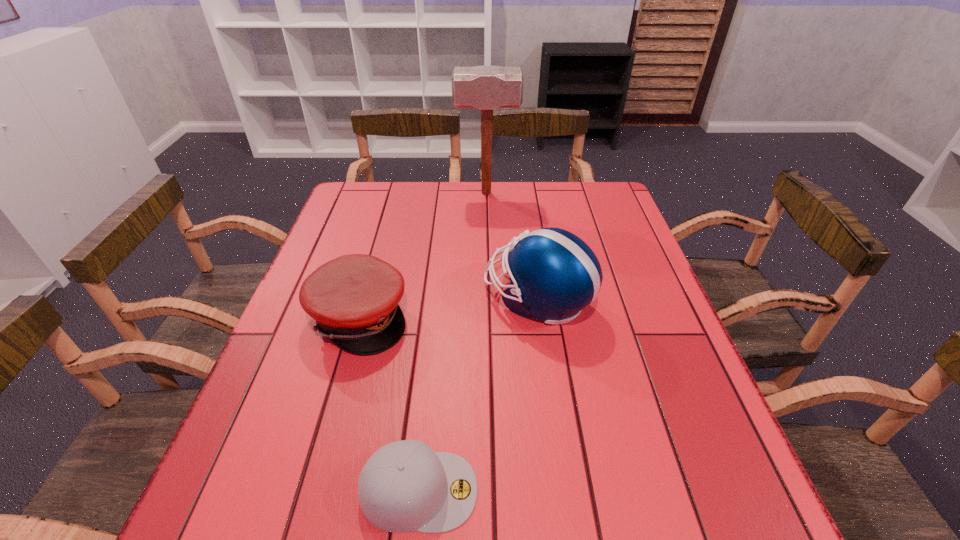
You are a GUI agent. You are given a task and a screenshot of the screen. Output one action in this format:
    pyautogui.click(x=<x>, y=<y>)
    Task: Click on the tallest object
    Image resolution: width=960 pixels, height=540 pixels.
    Given the screenshot: What is the action you would take?
    pyautogui.click(x=487, y=88)

The image size is (960, 540). I want to click on the farthest object, so click(x=487, y=88).

At what (x,y) coordinates should I click in order to perform the action: click on the third shortest object. Please return your answer as a coordinate pair (x, y). The width and height of the screenshot is (960, 540). Looking at the image, I should click on (554, 274).

The image size is (960, 540). What are the coordinates of `the taller cap` in the screenshot? It's located at (354, 298).

Where is `the farther cap`? This screenshot has height=540, width=960. the farther cap is located at coordinates (354, 298).

I want to click on the shortest object, so click(405, 486).

Image resolution: width=960 pixels, height=540 pixels. Identify the location of the nearest object. (405, 486).

Image resolution: width=960 pixels, height=540 pixels. I want to click on blank space located on the striking face of the mallet, so click(346, 193).

Image resolution: width=960 pixels, height=540 pixels. I want to click on free location located on the striking face of the mallet, so click(x=415, y=193).

The width and height of the screenshot is (960, 540). I want to click on free space located on the striking face of the mallet, so click(x=346, y=193).